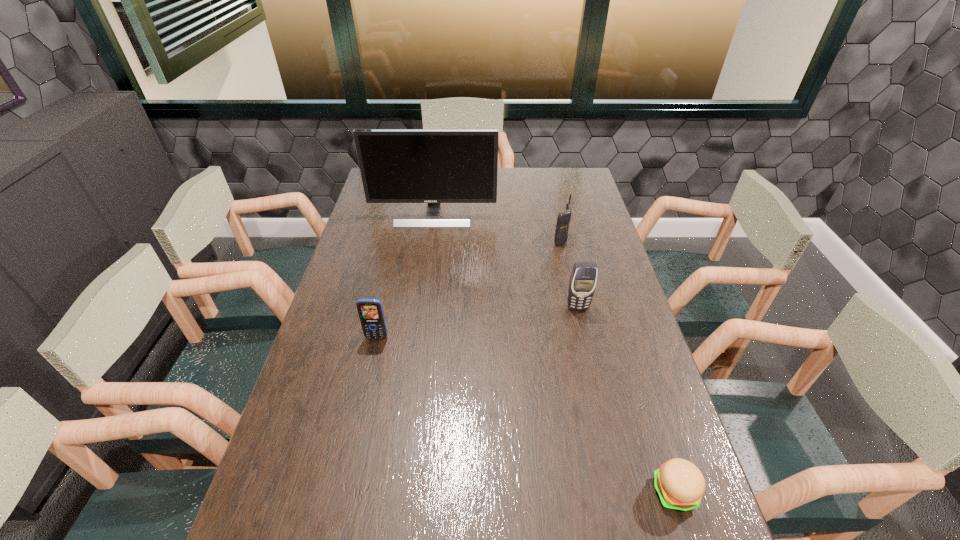
I want to click on empty location between the leftmost cellular telephone and the farthest cellular telephone, so click(x=468, y=288).

The image size is (960, 540). I want to click on the fourth closest object to the farthest cellular telephone, so click(680, 485).

This screenshot has width=960, height=540. What are the coordinates of `object that stands as the fourth closest to the farthest object` in the screenshot? It's located at (680, 485).

Locate an element on the screen. This screenshot has height=540, width=960. the closest cellular telephone to the second nearest object is located at coordinates (583, 279).

The width and height of the screenshot is (960, 540). In order to click on cellular telephone that stands as the third closest to the tallest object in this screenshot , I will do `click(370, 311)`.

Identify the location of vacant region that satisfies the following two spatial constraints: 1. on the screen side of the shortest object; 2. on the left side of the farthest object. (395, 492).

You are a GUI agent. You are given a task and a screenshot of the screen. Output one action in this format:
    pyautogui.click(x=<x>, y=<y>)
    Task: Click on the free location that satisfies the following two spatial constraints: 1. on the screen of the nearest cellular telephone; 2. on the right side of the rightmost object
    The height and width of the screenshot is (540, 960).
    Given the screenshot: What is the action you would take?
    pyautogui.click(x=342, y=492)

At what (x,y) coordinates should I click in order to perform the action: click on vacant space that satisfies the following two spatial constraints: 1. on the screen of the leftmost cellular telephone; 2. on the right side of the rightmost object. Please return your answer as a coordinate pair (x, y). Looking at the image, I should click on coord(342,492).

Where is `free space that satisfies the following two spatial constraints: 1. on the screen side of the nearest object; 2. on the right side of the farthest object`? This screenshot has height=540, width=960. free space that satisfies the following two spatial constraints: 1. on the screen side of the nearest object; 2. on the right side of the farthest object is located at coordinates (395, 492).